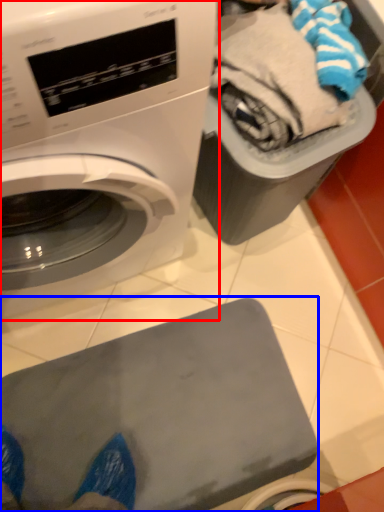
Question: Which object appears closest to the camera in this image, washing machine (highlighted by a red box) or appliance (highlighted by a blue box)?

Choices:
 (A) washing machine
 (B) appliance

Answer: (A)